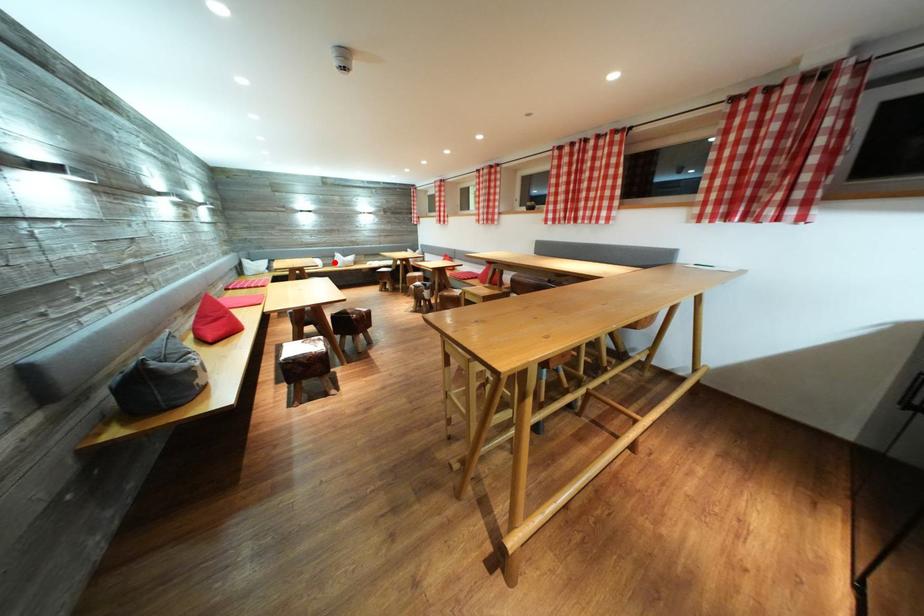
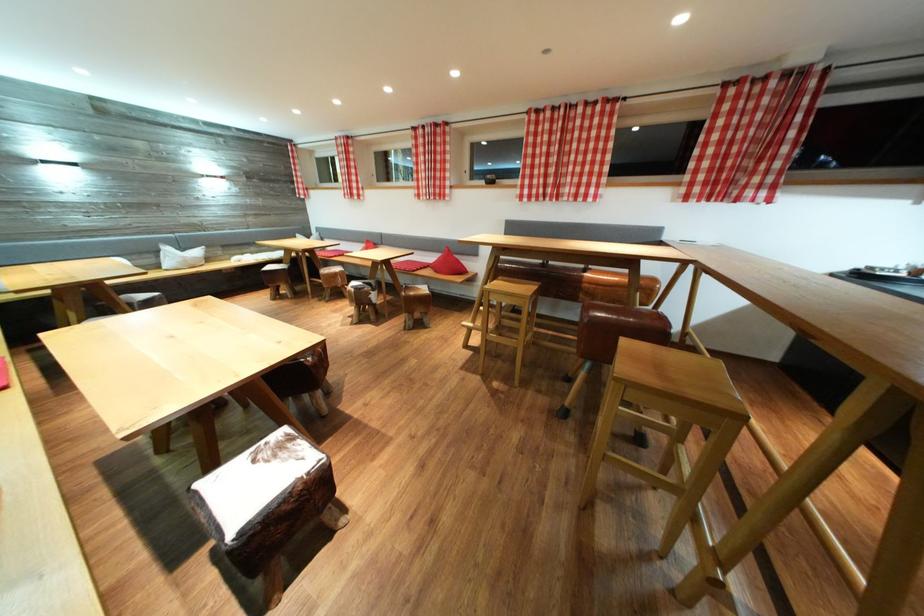
The point at the highlighted location is marked in the first image. Where is the corresponding point in the second image?

(151, 259)